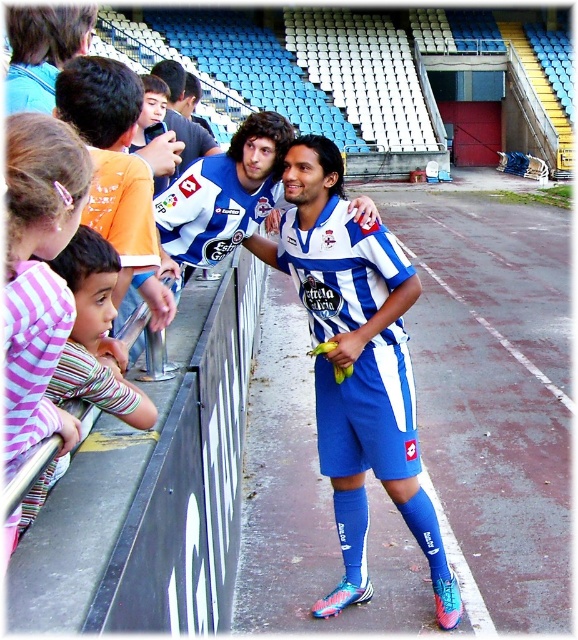
Question: Is white and blue striped jersey at center in front of blue/white striped jersey at center?

Choices:
 (A) yes
 (B) no

Answer: (A)

Question: Which of the following is the closest to the observer?

Choices:
 (A) pink striped shirt at left
 (B) striped fabric shirt at left
 (C) blue/white striped jersey at center
 (D) white and blue striped jersey at center

Answer: (A)

Question: Which of the following is the closest to the observer?

Choices:
 (A) striped fabric shirt at left
 (B) white and blue striped jersey at center
 (C) pink striped shirt at left

Answer: (C)

Question: Can you confirm if pink striped shirt at left is thinner than striped fabric shirt at left?

Choices:
 (A) yes
 (B) no

Answer: (A)

Question: Among these objects, which one is nearest to the camera?

Choices:
 (A) striped fabric shirt at left
 (B) white and blue striped jersey at center

Answer: (A)

Question: Where is blue/white striped jersey at center located in relation to pink striped shirt at left in the image?

Choices:
 (A) above
 (B) below

Answer: (B)